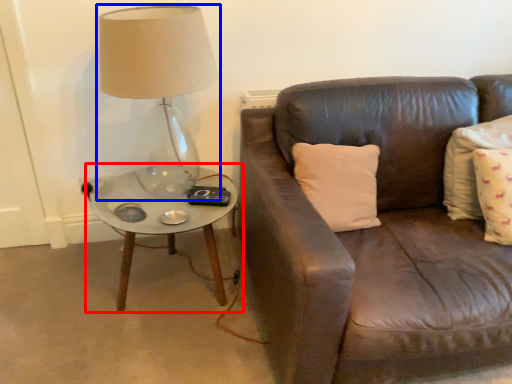
Question: Which of the following is the farthest to the observer, coffee table (highlighted by a red box) or lamp (highlighted by a blue box)?

Choices:
 (A) coffee table
 (B) lamp

Answer: (A)